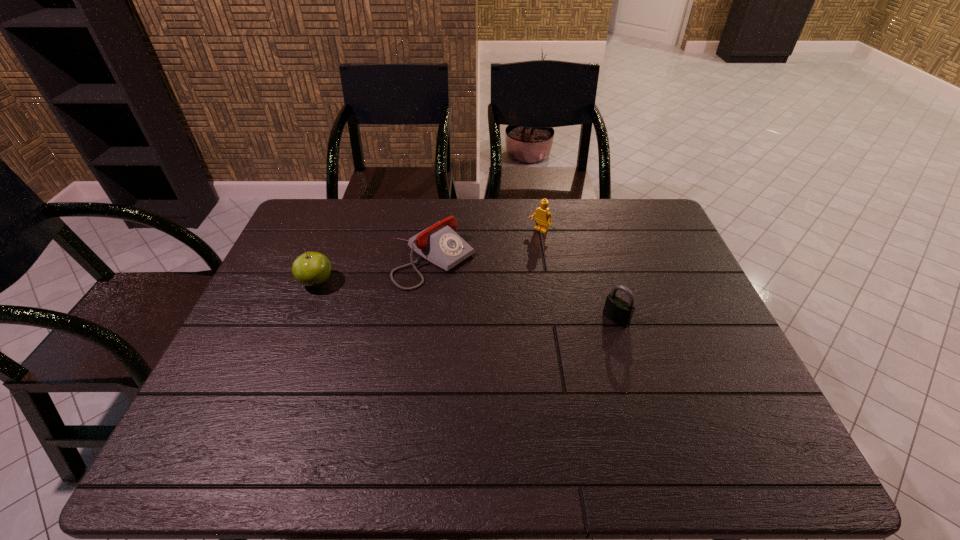
Locate an element on the screen. vacant space situated 0.320m on the dial of the third object from right to left is located at coordinates (552, 339).

At what (x,y) coordinates should I click in order to perform the action: click on vacant region located on the face of the third object from left to right. Please return your answer as a coordinate pair (x, y). This screenshot has height=540, width=960. Looking at the image, I should click on (484, 280).

Where is `blank space located on the face of the third object from left to right`? blank space located on the face of the third object from left to right is located at coordinates (494, 271).

What are the coordinates of `free spot located on the face of the third object from left to right` in the screenshot? It's located at (491, 275).

Identify the location of telephone that is positioned at the far edge. The height and width of the screenshot is (540, 960). pyautogui.click(x=440, y=244).

What are the coordinates of `Lego positioned at the far edge` in the screenshot? It's located at (542, 214).

Locate an element on the screen. This screenshot has width=960, height=540. object that is at the left edge is located at coordinates (311, 269).

In the image, there is a desktop. Where is `free space at the far edge`? free space at the far edge is located at coordinates (494, 240).

Locate an element on the screen. The height and width of the screenshot is (540, 960). vacant space at the left edge of the desktop is located at coordinates (227, 386).

This screenshot has width=960, height=540. I want to click on free space at the right edge, so click(699, 306).